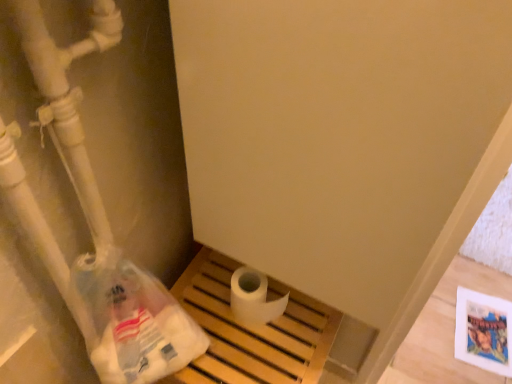
Where is `unoccupied region to the right of white matte toilet paper at center`? unoccupied region to the right of white matte toilet paper at center is located at coordinates (303, 315).